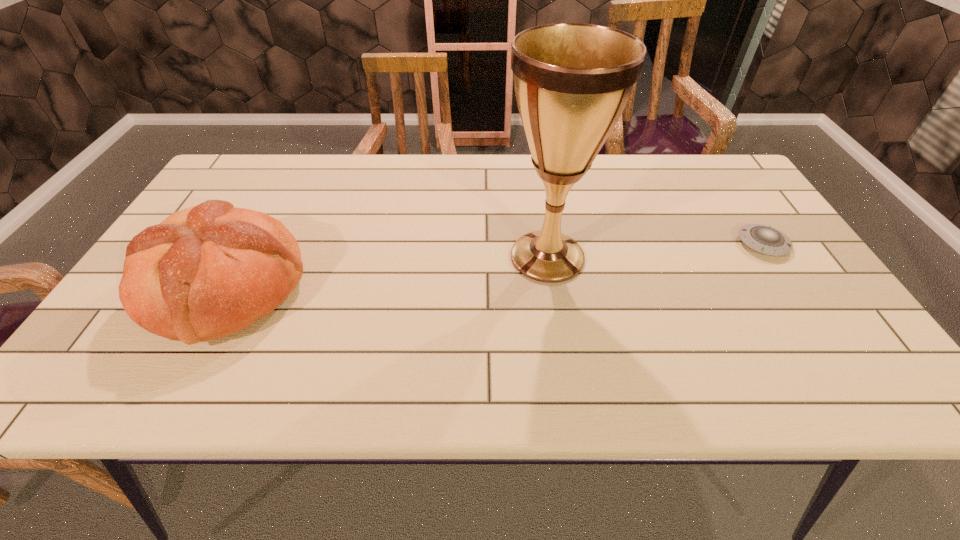
Find the location of a particular element. vacant position in the image that satisfies the following two spatial constraints: 1. on the back side of the tallest object; 2. on the right side of the leftmost object is located at coordinates (244, 257).

The height and width of the screenshot is (540, 960). Identify the location of free spot that satisfies the following two spatial constraints: 1. on the back side of the tallest object; 2. on the left side of the second shortest object. (244, 257).

This screenshot has width=960, height=540. I want to click on vacant point that satisfies the following two spatial constraints: 1. on the back side of the bread; 2. on the right side of the saucer, so click(251, 244).

Locate an element on the screen. The image size is (960, 540). vacant region that satisfies the following two spatial constraints: 1. on the back side of the tallest object; 2. on the left side of the leftmost object is located at coordinates 244,257.